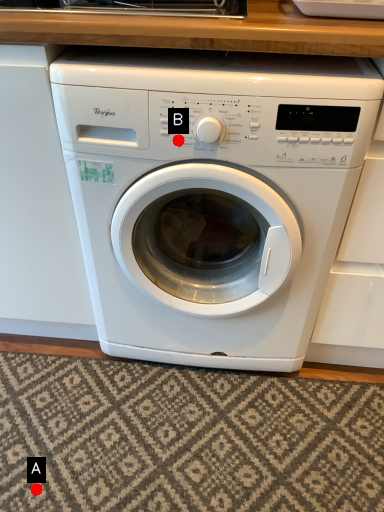
Question: Two points are circled on the image, labeled by A and B beside each circle. Which point is closer to the camera?

Choices:
 (A) A is closer
 (B) B is closer

Answer: (B)